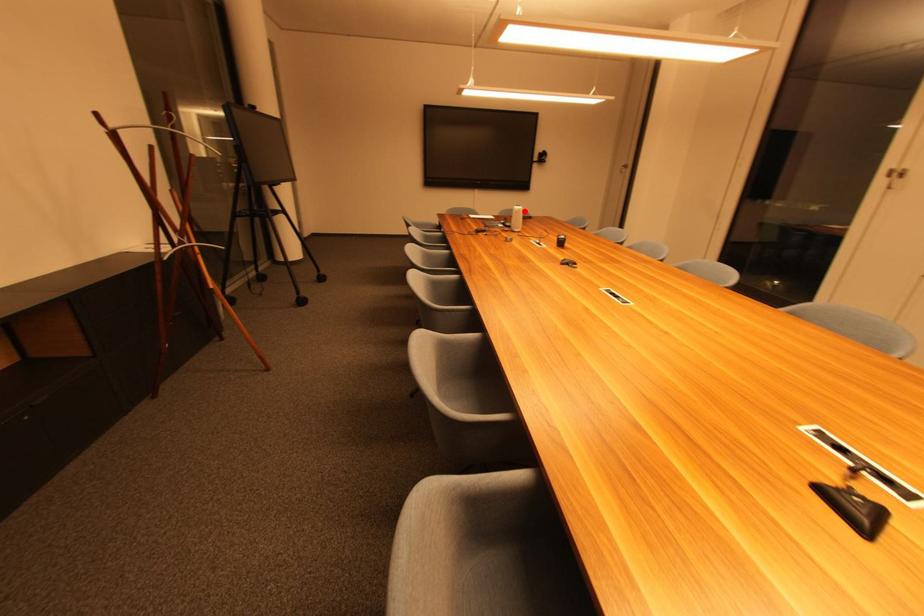
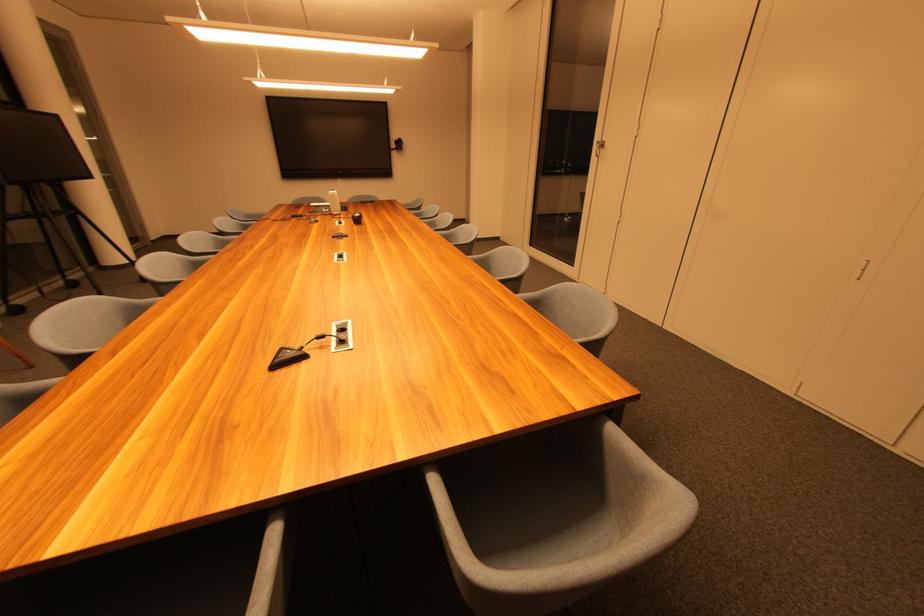
Question: I am providing you with two images of the same scene from different viewpoints. A red point is marked on the first image. At the location where the point appears in image 1, is it still visible in image 2?

Choices:
 (A) Yes
 (B) No

Answer: (A)